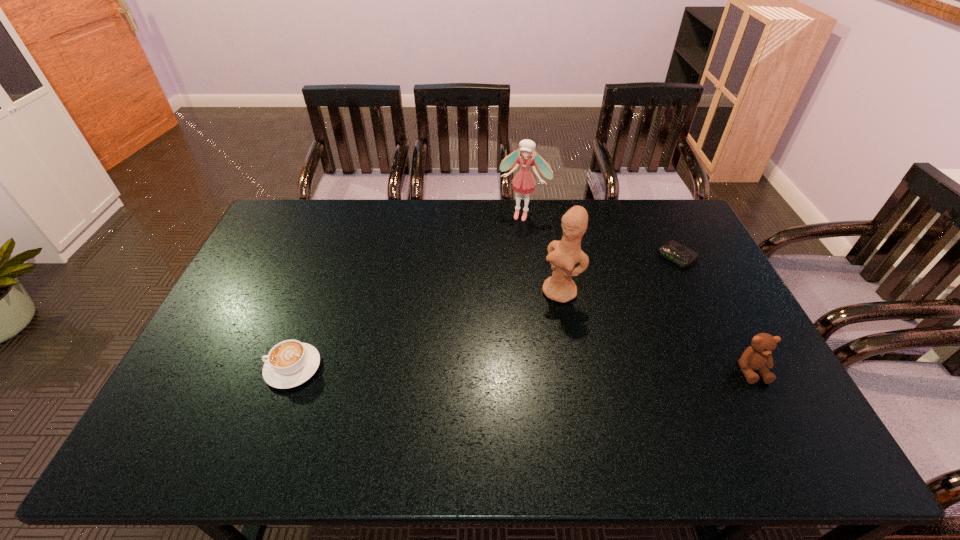
Image resolution: width=960 pixels, height=540 pixels. Identify the location of free space on the desktop that is between the second shortest object and the third tallest object and is positioned on the display of the alarm clock. (537, 369).

I want to click on vacant spot on the desktop that is between the leftmost object and the third tallest object and is positioned on the front-facing side of the farthest object, so click(x=456, y=368).

Identify the location of free space on the desktop that is between the leftmost object and the third tallest object and is positioned on the front-facing side of the third nearest object. The height and width of the screenshot is (540, 960). (489, 369).